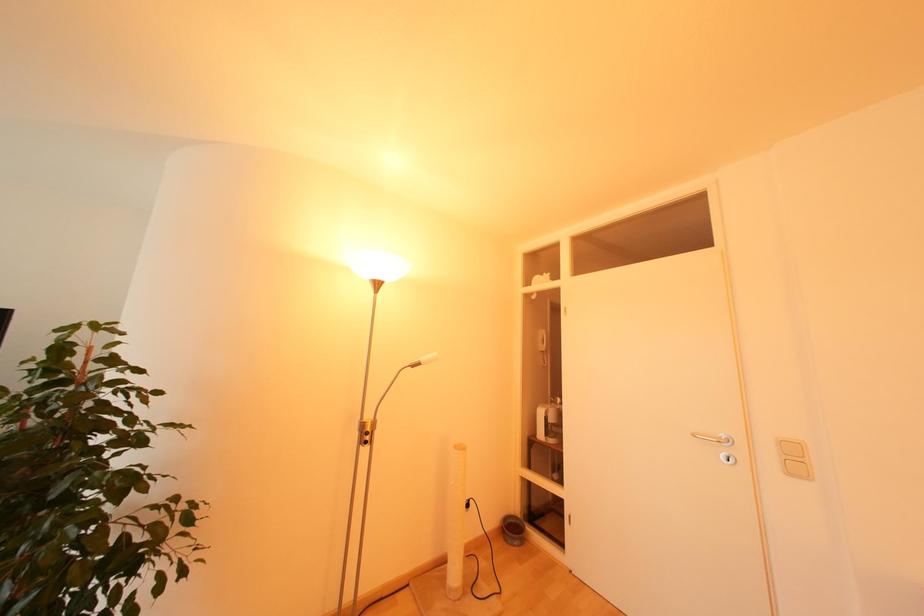
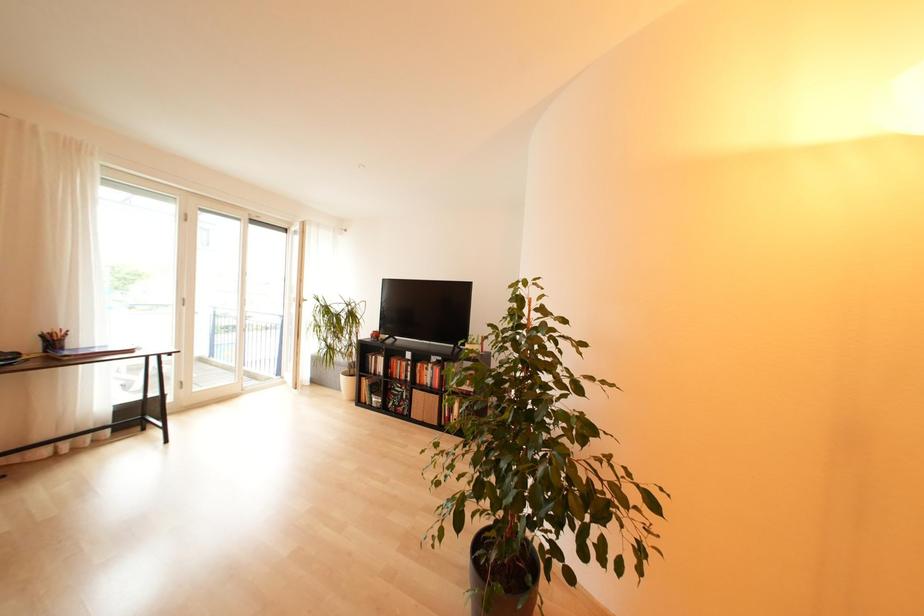
Question: The camera is either moving clockwise (left) or counter-clockwise (right) around the object. The first image is from the beginning of the video and the second image is from the end. Is the camera moving left or right when shooting the video?

Choices:
 (A) Left
 (B) Right

Answer: (B)